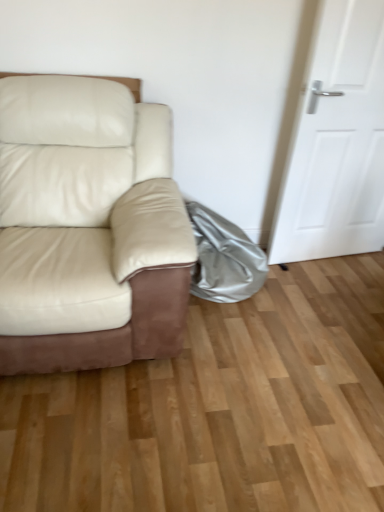
At what (x,y) coordinates should I click in order to perform the action: click on vacant space that is in between white matte door at right and shiny metallic bag at lower right. Please return your answer as a coordinate pair (x, y). This screenshot has height=512, width=384. Looking at the image, I should click on (323, 273).